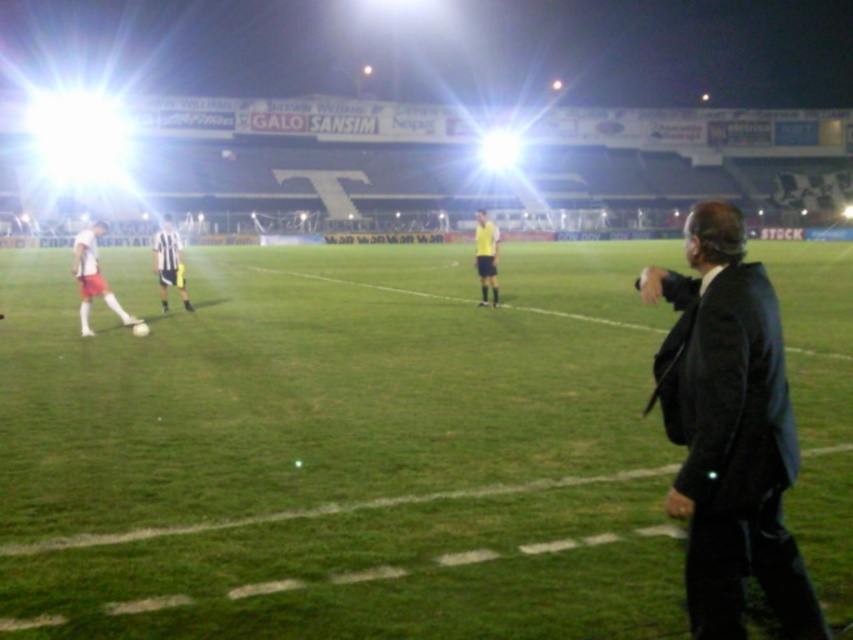
Who is more forward, (57, 614) or (486, 253)?

Positioned in front is point (57, 614).

Identify the location of green grass at center. (339, 449).

Between green grass at center and striped jersey at left, which one has less height?

With less height is green grass at center.

In order to click on green grass at center in this screenshot , I will do `click(339, 449)`.

Can you confirm if black matte suit at right is positioned below yellow jersey at center?

Indeed, black matte suit at right is positioned under yellow jersey at center.

Image resolution: width=853 pixels, height=640 pixels. I want to click on black matte suit at right, so click(729, 432).